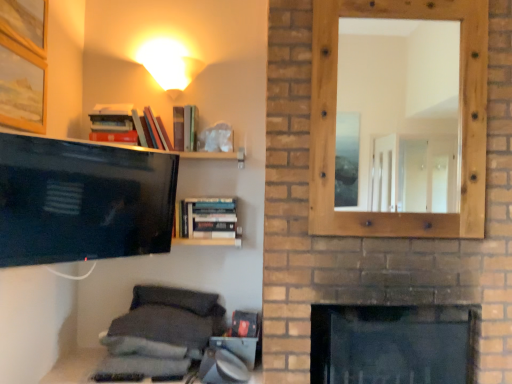
Question: From the image's perspective, relative to gray fabric pillow at lower center, which ranks as the 1th pillow in bottom-to-top order, is dark gray fabric pillow at lower center, arranged as the first pillow when viewed from the top, above or below?

Choices:
 (A) above
 (B) below

Answer: (A)

Question: Considering the positions of dark gray fabric pillow at lower center, marked as the third pillow in a bottom-to-top arrangement, and gray fabric pillow at lower center, which appears as the third pillow when viewed from the top, in the image, is dark gray fabric pillow at lower center, marked as the third pillow in a bottom-to-top arrangement, wider or thinner than gray fabric pillow at lower center, which appears as the third pillow when viewed from the top,?

Choices:
 (A) thin
 (B) wide

Answer: (A)

Question: Which object is the farthest from the gray fabric pillow at lower center, the 2th pillow from the top?

Choices:
 (A) dark gray fabric pillow at lower center, marked as the third pillow in a bottom-to-top arrangement
 (B) wooden mirror at upper right
 (C) matte black tv at left
 (D) wooden picture frame at upper left, the 1th picture frame when ordered from bottom to top
 (E) hardcover books at center

Answer: (B)

Question: Which object is positioned closest to the wooden picture frame at upper left, which is counted as the second picture frame, starting from the top?

Choices:
 (A) matte black tv at left
 (B) hardcover books at center
 (C) wooden mirror at upper right
 (D) gray fabric pillow at lower center, the 2th pillow from the top
 (E) dark gray fabric pillow at lower center, marked as the third pillow in a bottom-to-top arrangement

Answer: (A)